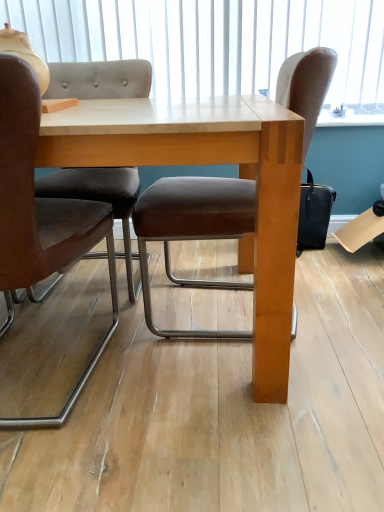
Question: From their relative heights in the image, would you say brown leather chair at left, arranged as the first chair when viewed from the left, is taller or shorter than white matte window screen at upper center?

Choices:
 (A) tall
 (B) short

Answer: (A)

Question: From a real-world perspective, relative to white matte window screen at upper center, is brown leather chair at left, arranged as the first chair when viewed from the left, vertically above or below?

Choices:
 (A) above
 (B) below

Answer: (B)

Question: Estimate the real-world distances between objects in this image. Which object is closer to the light wood table at center?

Choices:
 (A) brown leather chair at left, positioned as the second chair in right-to-left order
 (B) white matte window screen at upper center
 (C) brown leather chair at center, which is the 1th chair in right-to-left order

Answer: (C)

Question: Which of these objects is positioned farthest from the light wood table at center?

Choices:
 (A) brown leather chair at center, which is the 2th chair in left-to-right order
 (B) white matte window screen at upper center
 (C) brown leather chair at left, positioned as the second chair in right-to-left order

Answer: (B)